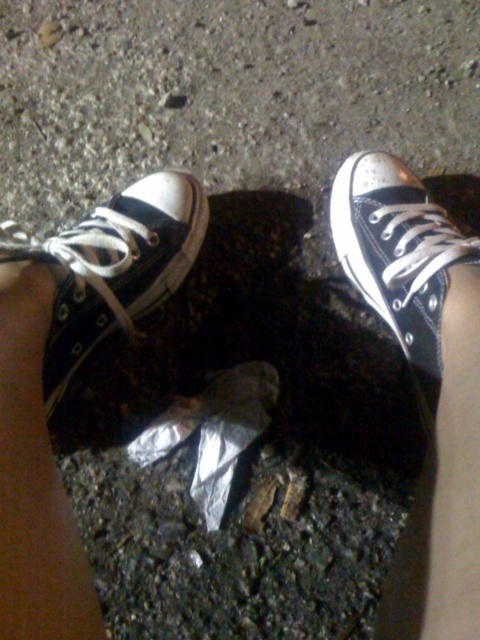
Can you confirm if matte canvas sneaker at lower left is wider than matte black sneaker at upper right?

Correct, the width of matte canvas sneaker at lower left exceeds that of matte black sneaker at upper right.

Based on the photo, between matte canvas sneaker at lower left and matte black sneaker at upper right, which one has more height?

Standing taller between the two is matte canvas sneaker at lower left.

At what (x,y) coordinates should I click in order to perform the action: click on matte canvas sneaker at lower left. Please return your answer as a coordinate pair (x, y). Looking at the image, I should click on (110, 300).

Find the location of a particular element. matte canvas sneaker at lower left is located at coordinates (110, 300).